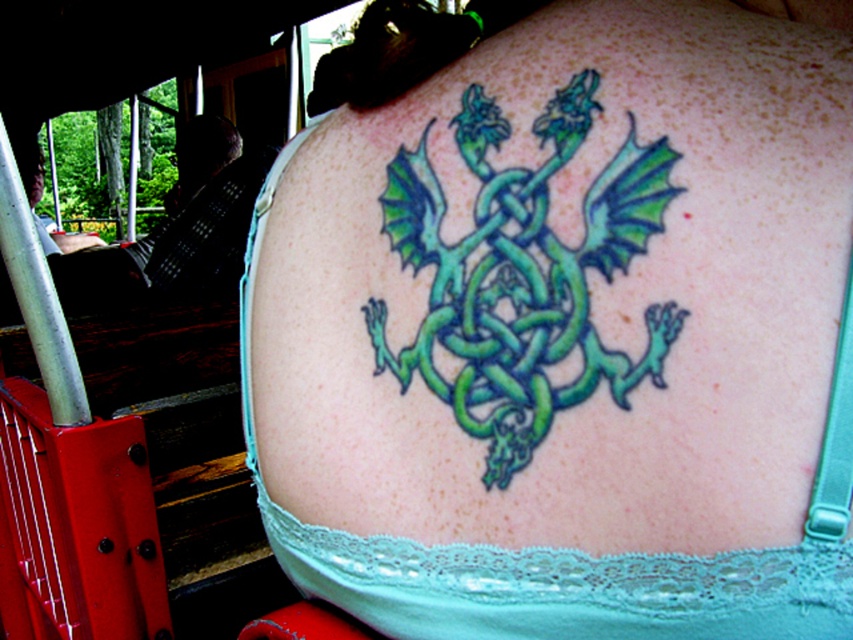
Question: Which point is farther to the camera?

Choices:
 (A) (461, 136)
 (B) (422, 368)

Answer: (B)

Question: Is green tattooed dragon at center smaller than green glossy dragon at center?

Choices:
 (A) yes
 (B) no

Answer: (B)

Question: Is green tattooed dragon at center above green glossy dragon at center?

Choices:
 (A) no
 (B) yes

Answer: (A)

Question: Is green tattooed dragon at center above green glossy dragon at center?

Choices:
 (A) no
 (B) yes

Answer: (A)

Question: Which point is farther to the camera?

Choices:
 (A) coord(314,344)
 (B) coord(596,220)

Answer: (A)